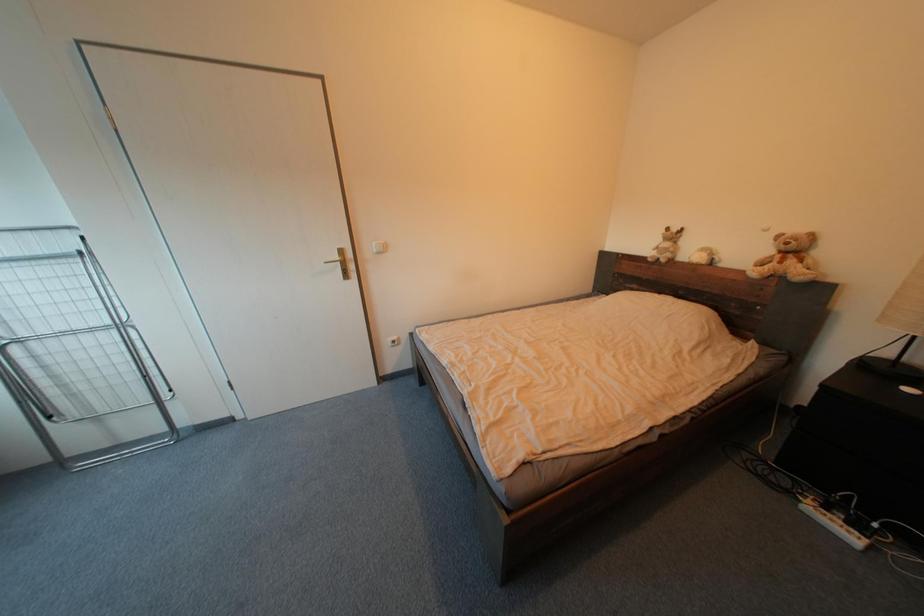
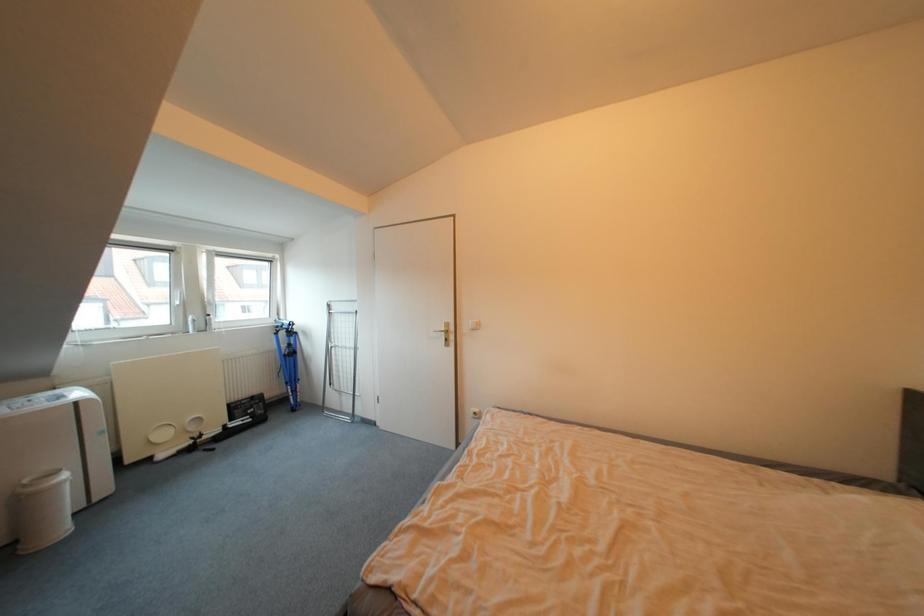
Question: The camera is either moving clockwise (left) or counter-clockwise (right) around the object. The first image is from the beginning of the video and the second image is from the end. Is the camera moving left or right when shooting the video?

Choices:
 (A) Left
 (B) Right

Answer: (B)